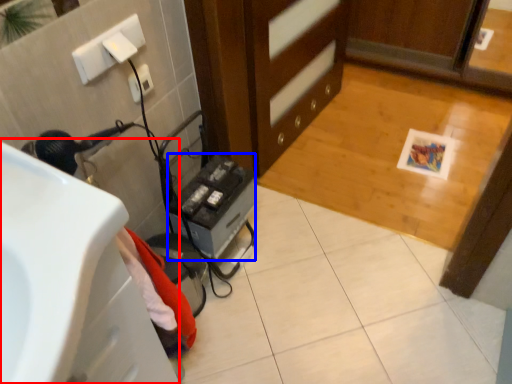
Question: Which object appears farthest to the camera in this image, sink (highlighted by a red box) or appliance (highlighted by a blue box)?

Choices:
 (A) sink
 (B) appliance

Answer: (B)